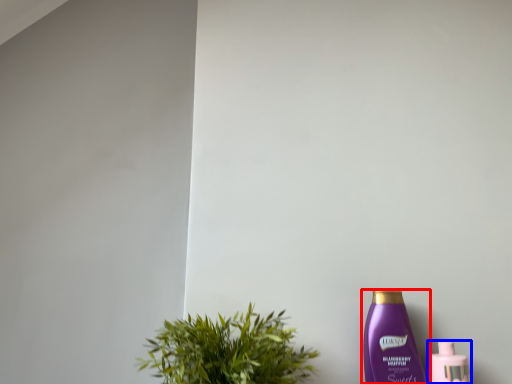
Question: Among these objects, which one is farthest to the camera, bottle (highlighted by a red box) or bottle (highlighted by a blue box)?

Choices:
 (A) bottle
 (B) bottle

Answer: (B)